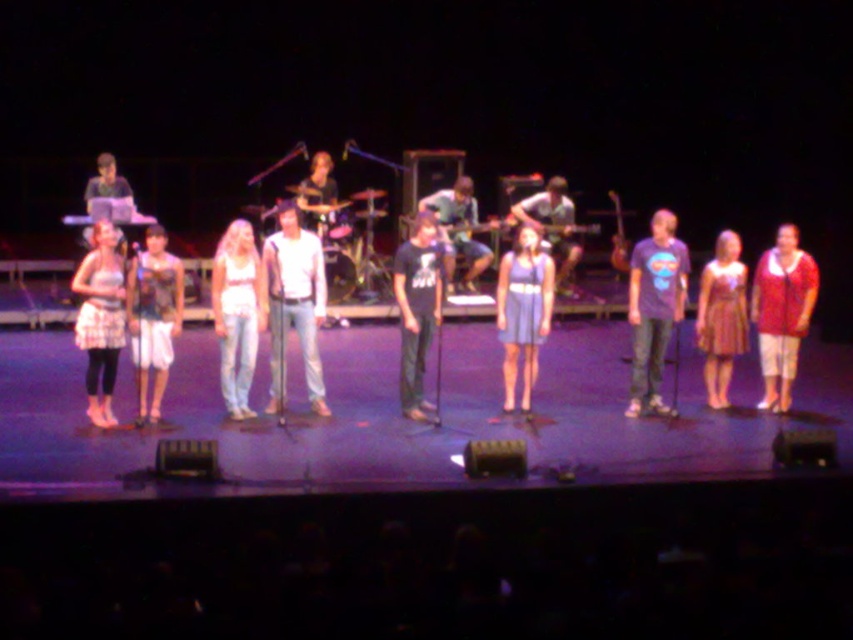
Which is behind, point (86, 321) or point (399, 262)?

Point (399, 262)

Is point (112, 292) closer to viewer compared to point (421, 403)?

Yes, point (112, 292) is closer to viewer.

This screenshot has height=640, width=853. What do you see at coordinates (100, 317) in the screenshot?
I see `white textured skirt at left` at bounding box center [100, 317].

This screenshot has height=640, width=853. I want to click on white textured skirt at left, so click(100, 317).

I want to click on matte black tank top at left, so click(154, 317).

Does point (155, 420) come farther from viewer compared to point (96, 408)?

Yes, point (155, 420) is behind point (96, 408).

Locate an element on the screen. This screenshot has width=853, height=640. matte black tank top at left is located at coordinates (154, 317).

Can you confirm if matte black guitar at center is smaller than white denim jeans at center?

Incorrect, matte black guitar at center is not smaller in size than white denim jeans at center.

Between point (564, 189) and point (256, 252), which one is positioned behind?

Point (564, 189)

Where is `matte black guitar at center`? This screenshot has width=853, height=640. matte black guitar at center is located at coordinates coord(511,224).